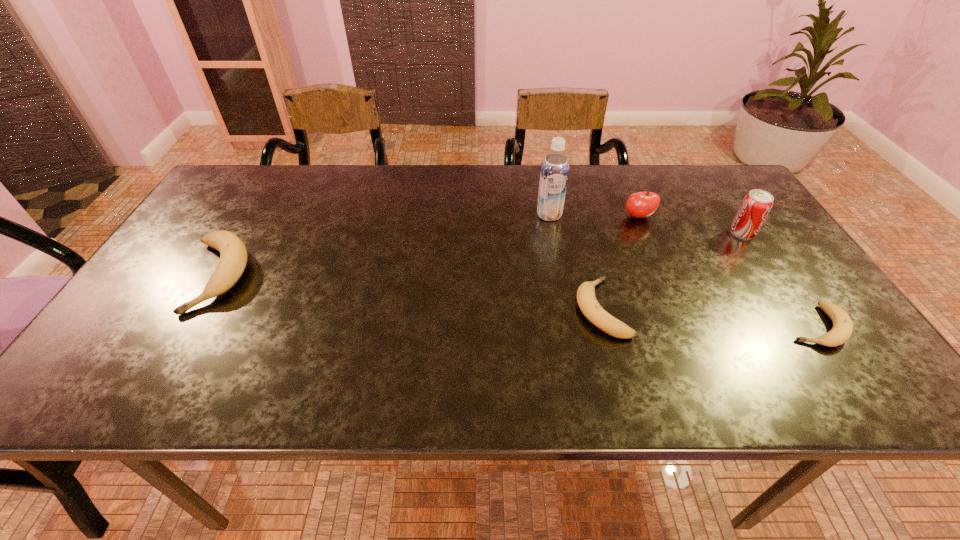
Find the location of `free point between the apple and the tallest object`. free point between the apple and the tallest object is located at coordinates (593, 215).

This screenshot has height=540, width=960. In order to click on free point between the fifth tallest object and the fourth nearest object in this screenshot , I will do `click(672, 271)`.

Where is `free spot between the apple and the rightmost banana`? Image resolution: width=960 pixels, height=540 pixels. free spot between the apple and the rightmost banana is located at coordinates (727, 271).

Where is `blank region between the second shortest object and the shortest object`? The image size is (960, 540). blank region between the second shortest object and the shortest object is located at coordinates (708, 317).

The width and height of the screenshot is (960, 540). What are the coordinates of `empty space between the tallest object and the second shortest banana` in the screenshot? It's located at (575, 261).

Where is `free space between the tallest banana and the third farthest object`? This screenshot has height=540, width=960. free space between the tallest banana and the third farthest object is located at coordinates (479, 254).

Identify the location of free space between the leftmost object and the tallest object. The width and height of the screenshot is (960, 540). (383, 245).

Choose which object is the third nearest neighbor to the leftmost banana. Please provide its 2D coordinates. Your answer should be formatted as a tuple, i.e. [(x, y)], where the tuple contains the x and y coordinates of a point satisfying the conditions above.

[(641, 204)]

Locate an element on the screen. The image size is (960, 540). the closest object to the second banana from right to left is located at coordinates (554, 174).

You are a GUI agent. You are given a task and a screenshot of the screen. Output one action in this format:
    pyautogui.click(x=<x>, y=<y>)
    Task: Click on the banana identified as the closest to the fifth shortest object
    The height and width of the screenshot is (540, 960).
    Given the screenshot: What is the action you would take?
    (x=842, y=329)